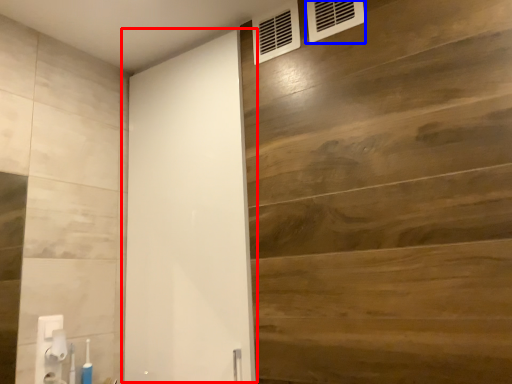
Question: Which of the following is the farthest to the observer, barn door (highlighted by a red box) or air conditioning (highlighted by a blue box)?

Choices:
 (A) barn door
 (B) air conditioning

Answer: (B)